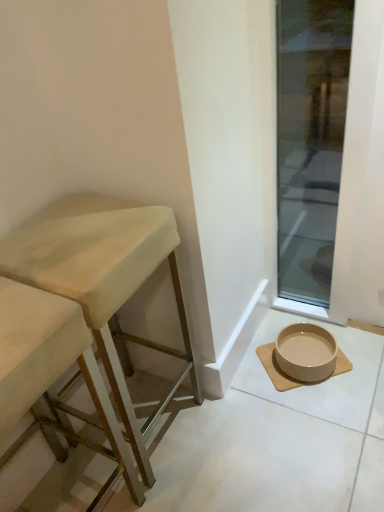
Question: Does transparent glass door at lower right have a smaller size compared to beige fabric stool at left, the 2th stool positioned from the left?

Choices:
 (A) yes
 (B) no

Answer: (A)

Question: From the image's perspective, does transparent glass door at lower right appear lower than beige fabric stool at left, the 2th stool positioned from the left?

Choices:
 (A) yes
 (B) no

Answer: (B)

Question: Considering the relative positions of transparent glass door at lower right and beige fabric stool at left, the 1th stool in the right-to-left sequence, in the image provided, is transparent glass door at lower right behind beige fabric stool at left, the 1th stool in the right-to-left sequence,?

Choices:
 (A) yes
 (B) no

Answer: (A)

Question: Can we say transparent glass door at lower right lies outside beige fabric stool at left, the 2th stool positioned from the left?

Choices:
 (A) yes
 (B) no

Answer: (A)

Question: Is transparent glass door at lower right positioned with its back to beige fabric stool at left, the 2th stool positioned from the left?

Choices:
 (A) yes
 (B) no

Answer: (B)

Question: Considering the positions of point pos(134,433) and point pos(301,353), is point pos(134,433) closer or farther from the camera than point pos(301,353)?

Choices:
 (A) closer
 (B) farther

Answer: (A)

Question: From a real-world perspective, is beige fabric stool at left, the 2th stool positioned from the left, positioned above or below beige ceramic bowl at lower right?

Choices:
 (A) above
 (B) below

Answer: (A)

Question: Relative to beige ceramic bowl at lower right, is beige fabric stool at left, the 2th stool positioned from the left, in front or behind?

Choices:
 (A) front
 (B) behind

Answer: (A)

Question: Is beige fabric stool at left, the 2th stool positioned from the left, inside the boundaries of beige ceramic bowl at lower right, or outside?

Choices:
 (A) inside
 (B) outside

Answer: (B)

Question: Considering the positions of wooden stool at left, which is the first stool in left-to-right order, and beige fabric stool at left, the 2th stool positioned from the left, in the image, is wooden stool at left, which is the first stool in left-to-right order, wider or thinner than beige fabric stool at left, the 2th stool positioned from the left,?

Choices:
 (A) wide
 (B) thin

Answer: (A)

Question: From a real-world perspective, is wooden stool at left, marked as the second stool in a right-to-left arrangement, positioned above or below beige fabric stool at left, the 2th stool positioned from the left?

Choices:
 (A) above
 (B) below

Answer: (B)

Question: Does point (11, 392) appear closer or farther from the camera than point (99, 247)?

Choices:
 (A) closer
 (B) farther

Answer: (A)

Question: Considering the relative positions of wooden stool at left, marked as the second stool in a right-to-left arrangement, and beige fabric stool at left, the 1th stool in the right-to-left sequence, in the image provided, is wooden stool at left, marked as the second stool in a right-to-left arrangement, to the left or to the right of beige fabric stool at left, the 1th stool in the right-to-left sequence,?

Choices:
 (A) left
 (B) right

Answer: (A)

Question: Looking at the image, does beige fabric stool at left, the 2th stool positioned from the left, seem bigger or smaller compared to transparent glass door at lower right?

Choices:
 (A) big
 (B) small

Answer: (A)

Question: From the image's perspective, is beige fabric stool at left, the 2th stool positioned from the left, located above or below transparent glass door at lower right?

Choices:
 (A) below
 (B) above

Answer: (A)